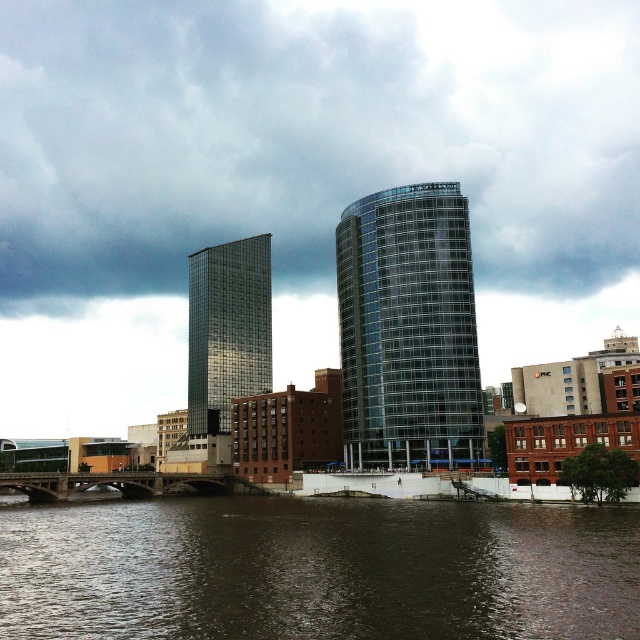
From the picture: You are a drone operator who needs to fly a drone between the brown water at lower center and the transparent glass tower at center. The drone has a maximum flight distance of 30 meters. Can the drone safely make this flight without exceeding its range?

The brown water at lower center and transparent glass tower at center are 31.64 meters apart from each other. Since the drone can only fly up to 30 meters, it cannot safely make this flight without exceeding its range.

You are a drone operator who needs to fly a drone between the cloudy sky at upper center and the shiny glass skyscraper at center. The drone has a maximum flight distance of 150 meters. Can the drone safely make this flight without exceeding its range?

The cloudy sky at upper center and shiny glass skyscraper at center are 151.00 meters apart from each other. Since the drone can only fly up to 150 meters, it cannot safely make this flight without exceeding its range.